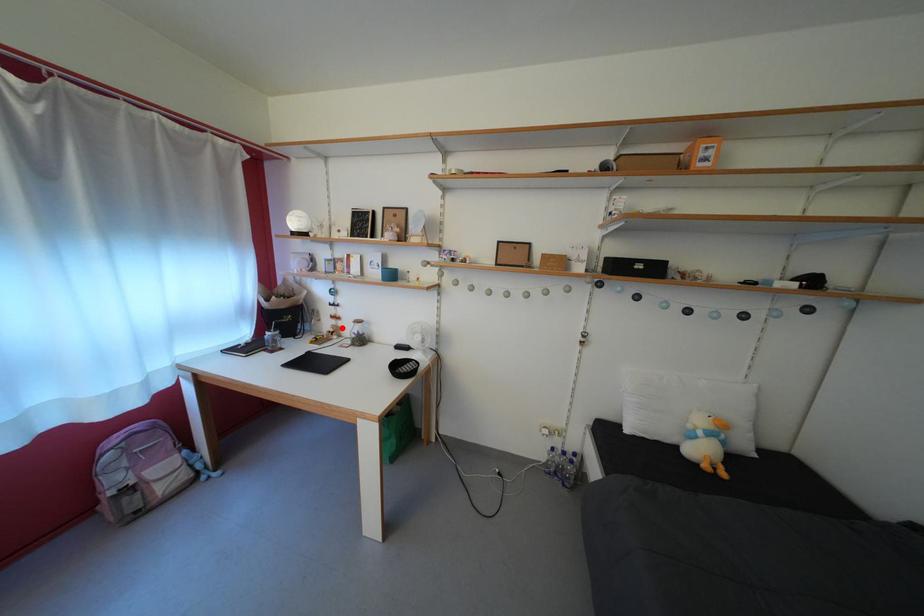
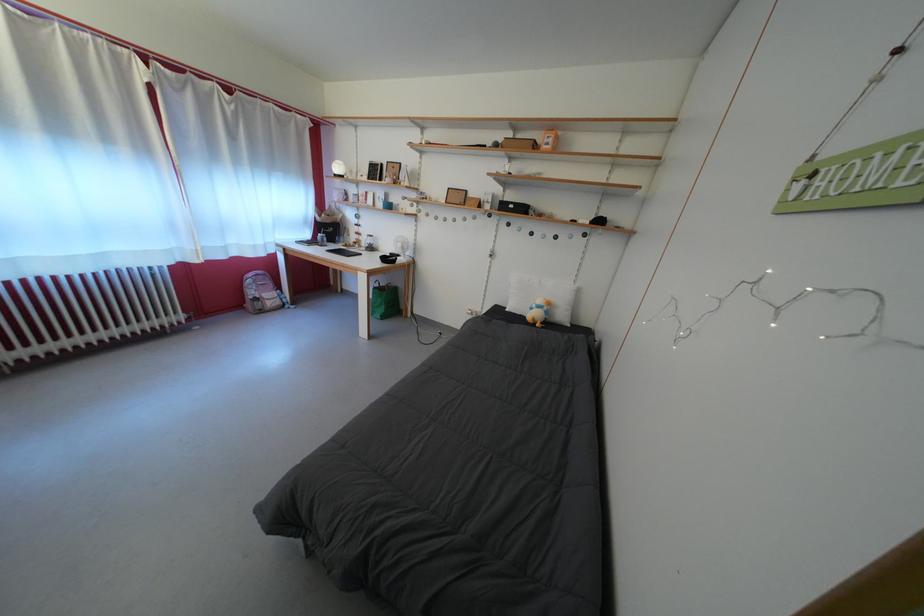
Where in the second image is the point corresponding to the highlighted location from the first image?

(365, 243)